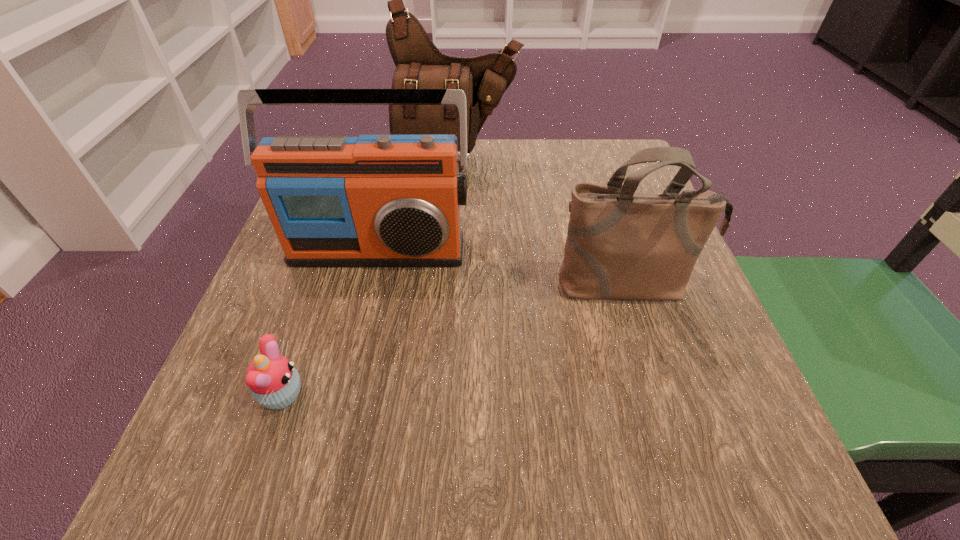
Where is `free region that satisfies the following two spatial constraints: 1. on the front-facing side of the radio receiver; 2. on the face of the shortest object`? This screenshot has height=540, width=960. free region that satisfies the following two spatial constraints: 1. on the front-facing side of the radio receiver; 2. on the face of the shortest object is located at coordinates (344, 395).